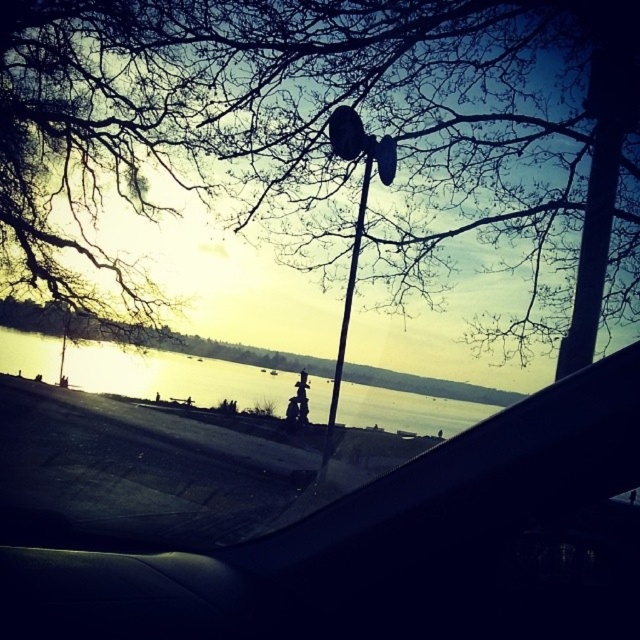
Is point (588, 13) positioned in front of point (337, 360)?

Yes, point (588, 13) is in front of point (337, 360).

Is black metal pole at upper right closer to the viewer compared to matte black lamp post at center?

That is True.

Is point (602, 67) positioned after point (355, 157)?

No, it is not.

The height and width of the screenshot is (640, 640). Identify the location of black metal pole at upper right. (602, 161).

Is silvery reflective water at center bigger than black metal pole at upper right?

Yes.

Which of these two, silvery reflective water at center or black metal pole at upper right, stands taller?

black metal pole at upper right

Find the location of a particular element. The image size is (640, 640). silvery reflective water at center is located at coordinates (173, 376).

Find the location of a particular element. This screenshot has height=640, width=640. silvery reflective water at center is located at coordinates (173, 376).

Which is in front, point (588, 99) or point (90, 385)?

Point (588, 99)

Does bare branches at upper center appear under silvery reflective water at center?

No.

Is point (164, 4) positioned before point (6, 362)?

Yes, it is.

Where is `bare branches at upper center`? This screenshot has height=640, width=640. bare branches at upper center is located at coordinates (426, 134).